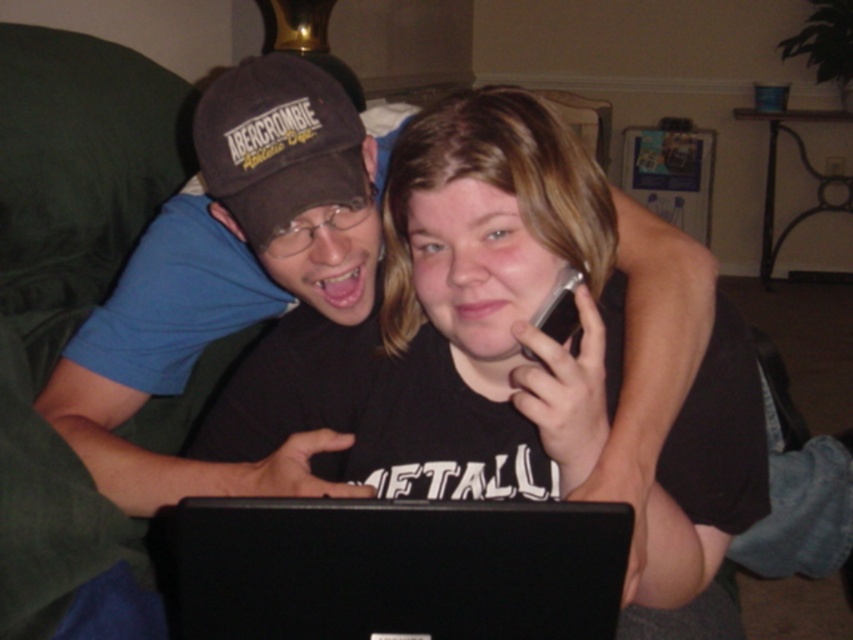
The height and width of the screenshot is (640, 853). Describe the element at coordinates (390, 568) in the screenshot. I see `black matte laptop at center` at that location.

Is point (248, 611) less distant than point (572, 301)?

Yes, point (248, 611) is closer to viewer.

Which is behind, point (219, 536) or point (566, 307)?

The point (566, 307) is behind.

Find the location of a particular element. The width and height of the screenshot is (853, 640). black matte laptop at center is located at coordinates (390, 568).

Who is positioned more to the left, dark brown fabric baseball cap at upper left or silver metallic phone at upper center?

From the viewer's perspective, dark brown fabric baseball cap at upper left appears more on the left side.

Is point (310, 132) positioned in front of point (543, 328)?

No, it is not.

What are the coordinates of `dark brown fabric baseball cap at upper left` in the screenshot? It's located at (277, 144).

Is black matte laptop at center behind dark brown fabric baseball cap at upper left?

No, it is not.

Which is behind, point (227, 605) or point (221, 106)?

Positioned behind is point (221, 106).

Image resolution: width=853 pixels, height=640 pixels. I want to click on black matte laptop at center, so click(390, 568).